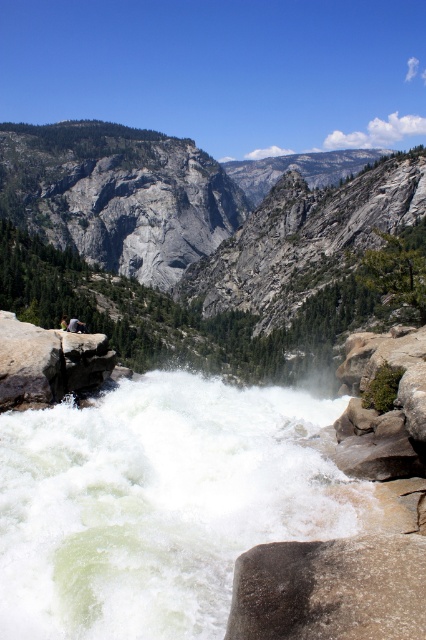
You are a hiker standing at the edge of the cliff overlooking the waterfall. You notice the white frothy water at center and the gray rough rock at lower center. Which object appears taller from your viewpoint?

The white frothy water at center appears taller than the gray rough rock at lower center because it has a greater height compared to it according to the description.

You are a hiker who has lost your jacket. You see a gray rock at center and a light brown leather jacket at center in the scene. According to the description, which object is positioned more to the right?

The gray rock at center is positioned to the right of the light brown leather jacket at center, so the gray rock at center is more to the right.